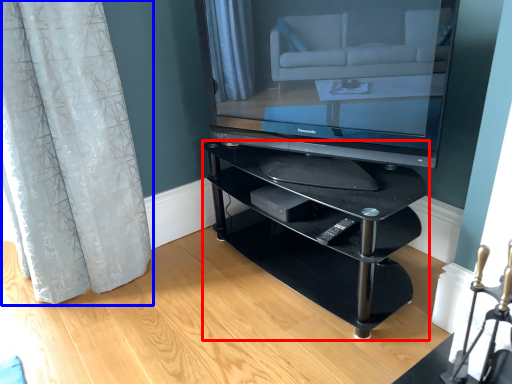
Question: Which point is further to the camera, shelf (highlighted by a red box) or curtain (highlighted by a blue box)?

Choices:
 (A) shelf
 (B) curtain

Answer: (A)